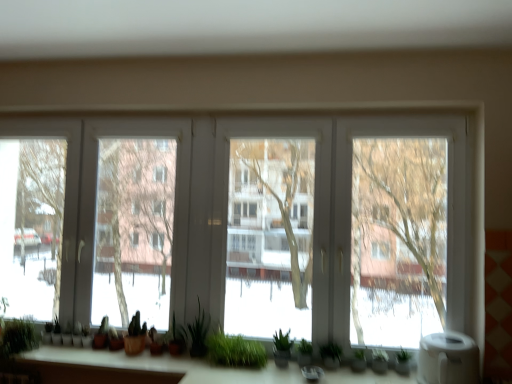
Question: Considering the relative positions of white matte water heater at lower right and green matte plant at center, which appears as the third plant when viewed from the left, in the image provided, is white matte water heater at lower right in front of green matte plant at center, which appears as the third plant when viewed from the left,?

Choices:
 (A) no
 (B) yes

Answer: (B)

Question: Can you confirm if white matte water heater at lower right is bigger than green matte plant at center, the fourth plant in the right-to-left sequence?

Choices:
 (A) yes
 (B) no

Answer: (A)

Question: Is white matte water heater at lower right turned away from green matte plant at center, the fourth plant in the right-to-left sequence?

Choices:
 (A) no
 (B) yes

Answer: (A)

Question: From a real-world perspective, is white matte water heater at lower right physically below green matte plant at center, the fourth plant in the right-to-left sequence?

Choices:
 (A) no
 (B) yes

Answer: (A)

Question: From the image's perspective, does white matte water heater at lower right appear higher than green matte plant at center, which appears as the third plant when viewed from the left?

Choices:
 (A) no
 (B) yes

Answer: (A)

Question: Considering their positions, is green matte plant at center, the fourth plant in the right-to-left sequence, located in front of or behind white matte water heater at lower right?

Choices:
 (A) behind
 (B) front

Answer: (A)

Question: In terms of size, does green matte plant at center, which appears as the third plant when viewed from the left, appear bigger or smaller than white matte water heater at lower right?

Choices:
 (A) small
 (B) big

Answer: (A)

Question: Considering the positions of point (180, 344) and point (434, 337), is point (180, 344) closer or farther from the camera than point (434, 337)?

Choices:
 (A) closer
 (B) farther

Answer: (B)

Question: Considering the positions of green matte plant at center, which appears as the third plant when viewed from the left, and white matte water heater at lower right in the image, is green matte plant at center, which appears as the third plant when viewed from the left, taller or shorter than white matte water heater at lower right?

Choices:
 (A) tall
 (B) short

Answer: (A)

Question: In terms of height, does white matte water heater at lower right look taller or shorter compared to green matte plant at lower center, which appears as the sixth plant when viewed from the left?

Choices:
 (A) tall
 (B) short

Answer: (A)

Question: Looking at the image, does white matte water heater at lower right seem bigger or smaller compared to green matte plant at lower center, which appears as the sixth plant when viewed from the left?

Choices:
 (A) small
 (B) big

Answer: (B)

Question: From a real-world perspective, is white matte water heater at lower right physically located above or below green matte plant at lower center, which ranks as the 1th plant in right-to-left order?

Choices:
 (A) below
 (B) above

Answer: (B)

Question: Is white matte water heater at lower right in front of or behind green matte plant at lower center, which appears as the sixth plant when viewed from the left, in the image?

Choices:
 (A) front
 (B) behind

Answer: (A)

Question: From the image's perspective, is white matte water heater at lower right located above or below green matte plant at center, which appears as the third plant when viewed from the left?

Choices:
 (A) below
 (B) above

Answer: (A)

Question: From a real-world perspective, is white matte water heater at lower right positioned above or below green matte plant at center, which appears as the third plant when viewed from the left?

Choices:
 (A) below
 (B) above

Answer: (B)